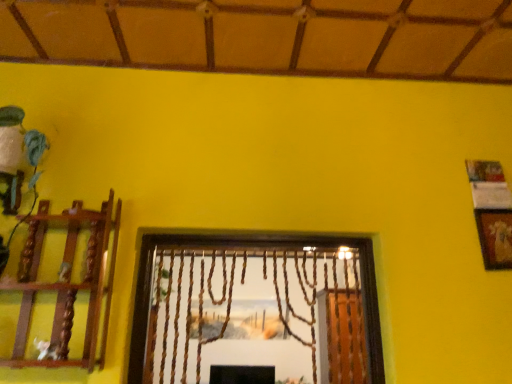
What do you see at coordinates (68, 282) in the screenshot? I see `wooden at left` at bounding box center [68, 282].

Where is `wooden at left`? wooden at left is located at coordinates (68, 282).

You are a GUI agent. You are given a task and a screenshot of the screen. Output one action in this format:
    pyautogui.click(x=<x>, y=<y>)
    Task: Click on the gold textured picture frame at upper right
    The width and height of the screenshot is (512, 384).
    Given the screenshot: What is the action you would take?
    pyautogui.click(x=495, y=237)

What do you see at coordinates (495, 237) in the screenshot?
I see `gold textured picture frame at upper right` at bounding box center [495, 237].

You are a GUI agent. You are given a task and a screenshot of the screen. Output one action in this format:
    pyautogui.click(x=<x>, y=<y>)
    Task: Click on the wooden at left
    
    Given the screenshot: What is the action you would take?
    pyautogui.click(x=68, y=282)

Would you say gold textured picture frame at upper right is to the left or to the right of wooden at left in the picture?

Based on their positions, gold textured picture frame at upper right is located to the right of wooden at left.

Is the depth of gold textured picture frame at upper right greater than that of wooden at left?

Yes.

Is point (481, 225) positioned behind point (108, 297)?

That is True.

From the picture: From the image's perspective, is gold textured picture frame at upper right below wooden at left?

Actually, gold textured picture frame at upper right appears above wooden at left in the image.

From a real-world perspective, is gold textured picture frame at upper right positioned over wooden at left based on gravity?

Yes.

Looking at their sizes, would you say gold textured picture frame at upper right is wider or thinner than wooden at left?

Clearly, gold textured picture frame at upper right has less width compared to wooden at left.

Which of these two, gold textured picture frame at upper right or wooden at left, stands shorter?

With less height is gold textured picture frame at upper right.

From the picture: Can you confirm if gold textured picture frame at upper right is bigger than wooden at left?

Actually, gold textured picture frame at upper right might be smaller than wooden at left.

Choose the correct answer: Is gold textured picture frame at upper right inside wooden at left or outside it?

gold textured picture frame at upper right is not enclosed by wooden at left.

Consider the image. Is the surface of gold textured picture frame at upper right in direct contact with wooden at left?

No, gold textured picture frame at upper right is not beside wooden at left.

Is gold textured picture frame at upper right turned away from wooden at left?

That's not correct — gold textured picture frame at upper right is not looking away from wooden at left.

From the picture: Can you tell me how much gold textured picture frame at upper right and wooden at left differ in facing direction?

The angular difference between gold textured picture frame at upper right and wooden at left is 0.751 degrees.

Where is `picture frame located behind the wooden at left`? Image resolution: width=512 pixels, height=384 pixels. picture frame located behind the wooden at left is located at coordinates (495, 237).

Which object is positioned more to the left, wooden at left or gold textured picture frame at upper right?

wooden at left is more to the left.

Does wooden at left come in front of gold textured picture frame at upper right?

Yes, it is.

Which is closer to the camera, (111,288) or (503,241)?

Point (111,288).

From the image's perspective, which object appears higher, wooden at left or gold textured picture frame at upper right?

gold textured picture frame at upper right appears higher in the image.

From the picture: From a real-world perspective, relative to gold textured picture frame at upper right, is wooden at left vertically above or below?

From a real-world perspective, wooden at left is physically below gold textured picture frame at upper right.

Can you confirm if wooden at left is wider than gold textured picture frame at upper right?

Correct, the width of wooden at left exceeds that of gold textured picture frame at upper right.

Between wooden at left and gold textured picture frame at upper right, which one has more height?

Standing taller between the two is wooden at left.

Based on their sizes in the image, would you say wooden at left is bigger or smaller than gold textured picture frame at upper right?

Considering their sizes, wooden at left takes up more space than gold textured picture frame at upper right.

From the picture: Can we say wooden at left lies outside gold textured picture frame at upper right?

Yes, wooden at left is outside of gold textured picture frame at upper right.

Is wooden at left directly adjacent to gold textured picture frame at upper right?

No, wooden at left is not making contact with gold textured picture frame at upper right.

Is wooden at left positioned with its back to gold textured picture frame at upper right?

No, gold textured picture frame at upper right is not at the back of wooden at left.

How different are the orientations of wooden at left and gold textured picture frame at upper right in degrees?

0.751 degrees separate the facing orientations of wooden at left and gold textured picture frame at upper right.

How far apart are wooden at left and gold textured picture frame at upper right?

The distance of wooden at left from gold textured picture frame at upper right is 4.78 feet.

At what (x,y) coordinates should I click in order to perform the action: click on shelf to the left of gold textured picture frame at upper right. Please return your answer as a coordinate pair (x, y). Looking at the image, I should click on (x=68, y=282).

Locate an element on the screen. This screenshot has height=384, width=512. shelf that appears on the left of gold textured picture frame at upper right is located at coordinates [x=68, y=282].

Identify the location of picture frame above the wooden at left (from the image's perspective). (x=495, y=237).